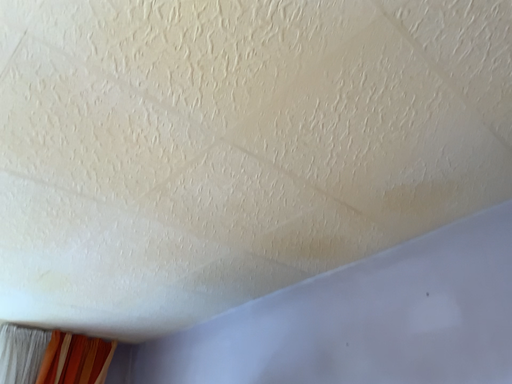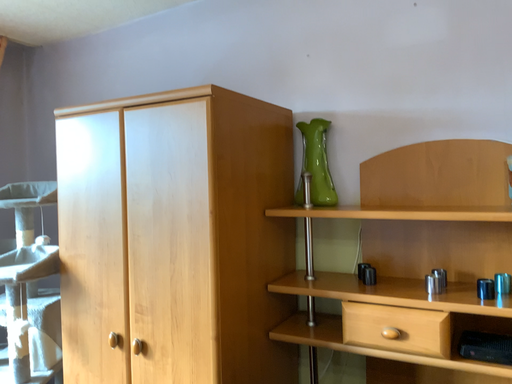
Question: Which way did the camera rotate in the video?

Choices:
 (A) rotated upward
 (B) rotated downward

Answer: (B)